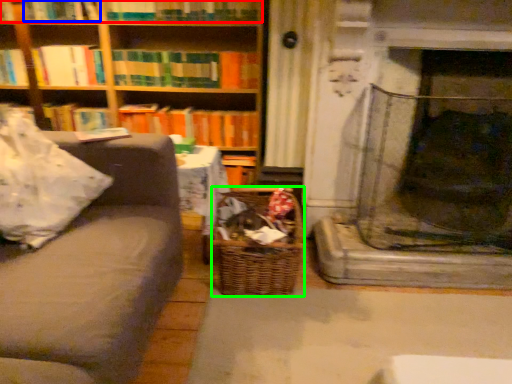
Question: Based on their relative distances, which object is farther from book (highlighted by a red box)? Choose from book (highlighted by a blue box) and basket (highlighted by a green box).

Choices:
 (A) book
 (B) basket

Answer: (B)